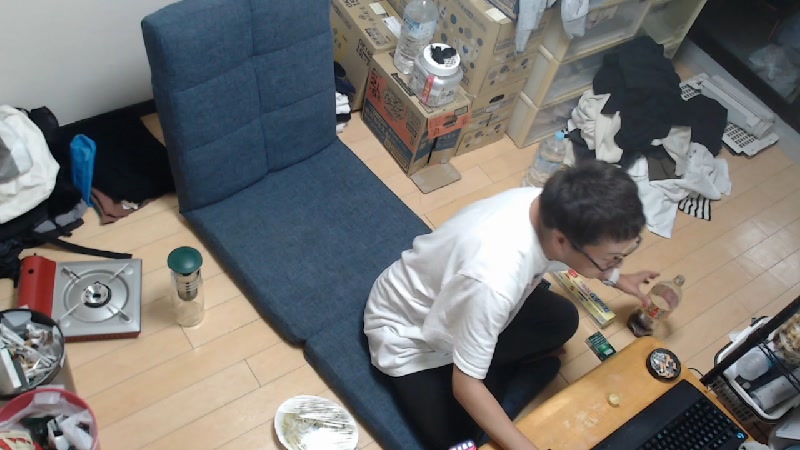
You are a GUI agent. You are given a task and a screenshot of the screen. Output one action in this format:
    pyautogui.click(x=<x>, y=<y>)
    Task: Click on the wooden tile
    The width and height of the screenshot is (800, 450).
    Given the screenshot: What is the action you would take?
    pyautogui.click(x=186, y=377)